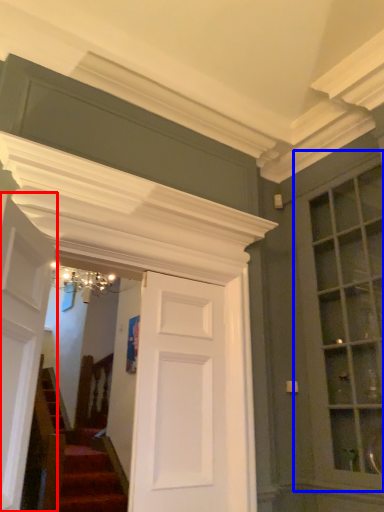
Question: Which of the following is the farthest to the observer, door (highlighted by a red box) or window (highlighted by a blue box)?

Choices:
 (A) door
 (B) window

Answer: (B)